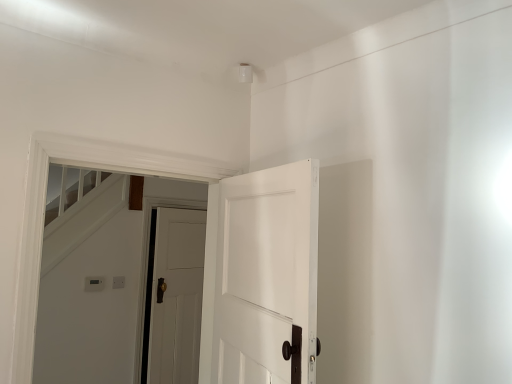
What is the approximate width of white painted wood door at center, marked as the first door in a front-to-back arrangement?

white painted wood door at center, marked as the first door in a front-to-back arrangement, is 4.79 inches wide.

Locate an element on the screen. The width and height of the screenshot is (512, 384). white painted wood door at center, which is the 2th door from left to right is located at coordinates (261, 277).

Measure the distance between point (280, 326) and camera.

Point (280, 326) and camera are 1.47 meters apart.

The height and width of the screenshot is (384, 512). Describe the element at coordinates (261, 277) in the screenshot. I see `white painted wood door at center, positioned as the 1th door in right-to-left order` at that location.

What do you see at coordinates (177, 296) in the screenshot? The height and width of the screenshot is (384, 512). I see `white wooden door at center, the 2th door in the right-to-left sequence` at bounding box center [177, 296].

Image resolution: width=512 pixels, height=384 pixels. Identify the location of white wooden door at center, the 1th door when ordered from left to right. (177, 296).

The height and width of the screenshot is (384, 512). In order to click on white painted wood door at center, marked as the first door in a front-to-back arrangement in this screenshot , I will do `click(261, 277)`.

Between white wooden door at center, the 1th door when ordered from back to front, and white painted wood door at center, positioned as the 1th door in right-to-left order, which one appears on the left side from the viewer's perspective?

white wooden door at center, the 1th door when ordered from back to front, is more to the left.

In the image, is white wooden door at center, the 1th door when ordered from back to front, positioned in front of or behind white painted wood door at center, marked as the second door in a back-to-front arrangement?

In the image, white wooden door at center, the 1th door when ordered from back to front, appears behind white painted wood door at center, marked as the second door in a back-to-front arrangement.

Which point is more distant from viewer, (181, 353) or (285, 231)?

The point (181, 353) is more distant.

From the image's perspective, is white wooden door at center, which is counted as the second door, starting from the front, over white painted wood door at center, marked as the second door in a back-to-front arrangement?

No, from the image's perspective, white wooden door at center, which is counted as the second door, starting from the front, is not above white painted wood door at center, marked as the second door in a back-to-front arrangement.

From a real-world perspective, is white wooden door at center, which is counted as the second door, starting from the front, physically located above or below white painted wood door at center, marked as the second door in a back-to-front arrangement?

From a real-world perspective, white wooden door at center, which is counted as the second door, starting from the front, is physically below white painted wood door at center, marked as the second door in a back-to-front arrangement.

Considering the sizes of white wooden door at center, the 2th door in the right-to-left sequence, and white painted wood door at center, positioned as the 1th door in right-to-left order, in the image, is white wooden door at center, the 2th door in the right-to-left sequence, wider or thinner than white painted wood door at center, positioned as the 1th door in right-to-left order,?

Considering their sizes, white wooden door at center, the 2th door in the right-to-left sequence, looks broader than white painted wood door at center, positioned as the 1th door in right-to-left order.

Considering the sizes of objects white wooden door at center, which is counted as the second door, starting from the front, and white painted wood door at center, positioned as the 1th door in right-to-left order, in the image provided, who is shorter, white wooden door at center, which is counted as the second door, starting from the front, or white painted wood door at center, positioned as the 1th door in right-to-left order,?

With less height is white painted wood door at center, positioned as the 1th door in right-to-left order.

Does white wooden door at center, which is counted as the second door, starting from the front, have a larger size compared to white painted wood door at center, positioned as the 1th door in right-to-left order?

Incorrect, white wooden door at center, which is counted as the second door, starting from the front, is not larger than white painted wood door at center, positioned as the 1th door in right-to-left order.

Is white painted wood door at center, which is the 2th door from left to right, surrounded by white wooden door at center, the 1th door when ordered from back to front?

Definitely not — white painted wood door at center, which is the 2th door from left to right, is not inside white wooden door at center, the 1th door when ordered from back to front.

Would you consider white wooden door at center, the 1th door when ordered from back to front, to be distant from white painted wood door at center, marked as the second door in a back-to-front arrangement?

Yes, white wooden door at center, the 1th door when ordered from back to front, and white painted wood door at center, marked as the second door in a back-to-front arrangement, are quite far apart.

Is white wooden door at center, the 1th door when ordered from left to right, looking in the opposite direction of white painted wood door at center, marked as the first door in a front-to-back arrangement?

white wooden door at center, the 1th door when ordered from left to right, does not have its back to white painted wood door at center, marked as the first door in a front-to-back arrangement.

Can you tell me how much white wooden door at center, the 1th door when ordered from back to front, and white painted wood door at center, marked as the second door in a back-to-front arrangement, differ in facing direction?

The angle between the facing direction of white wooden door at center, the 1th door when ordered from back to front, and the facing direction of white painted wood door at center, marked as the second door in a back-to-front arrangement, is 119 degrees.

Where is `door above the white wooden door at center, the 1th door when ordered from back to front (from a real-world perspective)`? The height and width of the screenshot is (384, 512). door above the white wooden door at center, the 1th door when ordered from back to front (from a real-world perspective) is located at coordinates (261, 277).

Does white painted wood door at center, which is the 2th door from left to right, appear on the left side of white wooden door at center, the 1th door when ordered from back to front?

No.

Considering the positions of objects white painted wood door at center, positioned as the 1th door in right-to-left order, and white wooden door at center, the 2th door in the right-to-left sequence, in the image provided, who is in front, white painted wood door at center, positioned as the 1th door in right-to-left order, or white wooden door at center, the 2th door in the right-to-left sequence,?

Positioned in front is white painted wood door at center, positioned as the 1th door in right-to-left order.

Considering the points (217, 331) and (196, 227), which point is behind, point (217, 331) or point (196, 227)?

The point (196, 227) is farther from the camera.

From the image's perspective, which one is positioned higher, white painted wood door at center, marked as the second door in a back-to-front arrangement, or white wooden door at center, the 1th door when ordered from back to front?

white painted wood door at center, marked as the second door in a back-to-front arrangement, is shown above in the image.

From a real-world perspective, is white painted wood door at center, marked as the second door in a back-to-front arrangement, physically located above or below white wooden door at center, the 1th door when ordered from back to front?

white painted wood door at center, marked as the second door in a back-to-front arrangement, is situated higher than white wooden door at center, the 1th door when ordered from back to front, in the real world.

Which object is thinner, white painted wood door at center, marked as the second door in a back-to-front arrangement, or white wooden door at center, the 1th door when ordered from back to front?

With smaller width is white painted wood door at center, marked as the second door in a back-to-front arrangement.

Considering the relative sizes of white painted wood door at center, which is the 2th door from left to right, and white wooden door at center, the 1th door when ordered from back to front, in the image provided, is white painted wood door at center, which is the 2th door from left to right, taller than white wooden door at center, the 1th door when ordered from back to front,?

In fact, white painted wood door at center, which is the 2th door from left to right, may be shorter than white wooden door at center, the 1th door when ordered from back to front.

Considering the relative sizes of white painted wood door at center, which is the 2th door from left to right, and white wooden door at center, the 1th door when ordered from back to front, in the image provided, is white painted wood door at center, which is the 2th door from left to right, smaller than white wooden door at center, the 1th door when ordered from back to front,?

Incorrect, white painted wood door at center, which is the 2th door from left to right, is not smaller in size than white wooden door at center, the 1th door when ordered from back to front.

Is white painted wood door at center, marked as the first door in a front-to-back arrangement, spatially inside white wooden door at center, which is counted as the second door, starting from the front, or outside of it?

white painted wood door at center, marked as the first door in a front-to-back arrangement, is located beyond the bounds of white wooden door at center, which is counted as the second door, starting from the front.

Are white painted wood door at center, positioned as the 1th door in right-to-left order, and white wooden door at center, the 1th door when ordered from left to right, located far from each other?

white painted wood door at center, positioned as the 1th door in right-to-left order, is far away from white wooden door at center, the 1th door when ordered from left to right.

Could you tell me if white painted wood door at center, positioned as the 1th door in right-to-left order, is facing white wooden door at center, the 1th door when ordered from left to right?

No, white painted wood door at center, positioned as the 1th door in right-to-left order, is not oriented towards white wooden door at center, the 1th door when ordered from left to right.

Identify the location of door on the right of white wooden door at center, the 2th door in the right-to-left sequence. coord(261,277).

Find the location of a particular element. The width and height of the screenshot is (512, 384). door located on the left of white painted wood door at center, which is the 2th door from left to right is located at coordinates (177, 296).

Locate an element on the screen. Image resolution: width=512 pixels, height=384 pixels. door behind the white painted wood door at center, marked as the first door in a front-to-back arrangement is located at coordinates (177, 296).